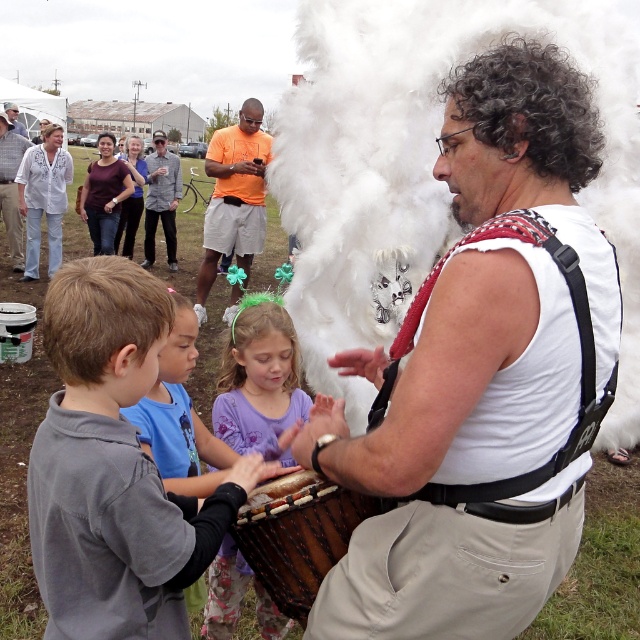
You are a photographer trying to capture a closeup of the purple fabric dress at center and the gray flannel shirt at upper left. Which clothing item would require you to move closer to the subject to get a clear shot?

The purple fabric dress at center is thinner than the gray flannel shirt at upper left, so you would need to move closer to the purple fabric dress at center to capture a clear shot.

You are a photographer standing in front of the drumming scene. You want to take a photo of the orange cotton shirt at center and the light gray shirt at upper left. Which shirt should you focus on first if you want to capture them both in the frame without moving the camera?

The orange cotton shirt at center is to the right of light gray shirt at upper left, so you should focus on the light gray shirt at upper left first as it is closer to the left side of the frame, allowing both shirts to be captured without moving the camera.

You are a photographer trying to capture a closeup of the orange cotton shirt at center and the light gray shirt at upper left. Which shirt should you zoom in on to ensure both are visible in the frame without moving the camera?

You should zoom in on the orange cotton shirt at center because it occupies less space than the light gray shirt at upper left, allowing both to fit within the frame when zoomed appropriately.